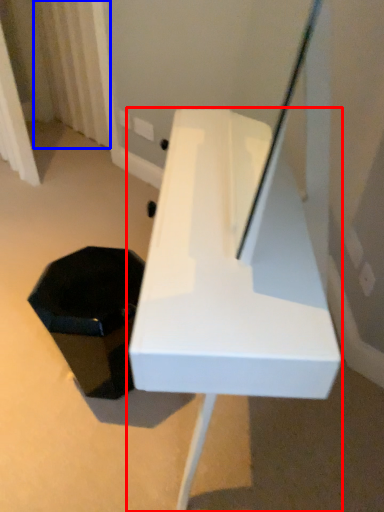
Question: Which point is closer to the camera, furniture (highlighted by a red box) or curtain (highlighted by a blue box)?

Choices:
 (A) furniture
 (B) curtain

Answer: (A)